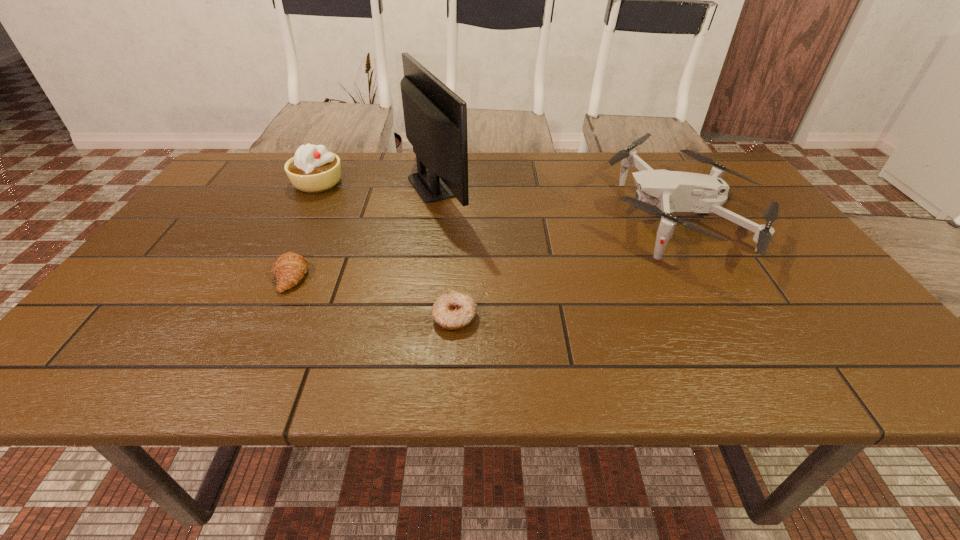
This screenshot has height=540, width=960. What are the coordinates of `vacant point at the left edge` in the screenshot? It's located at (192, 218).

Identify the location of free region at the right edge of the desktop. The image size is (960, 540). (801, 289).

You are a GUI agent. You are given a task and a screenshot of the screen. Output one action in this format:
    pyautogui.click(x=<x>, y=<y>)
    Task: Click on the vacant point at the near left corner
    The image size is (960, 540).
    Given the screenshot: What is the action you would take?
    pyautogui.click(x=132, y=374)

In the image, there is a desktop. In order to click on vacant space at the near right corner in this screenshot , I will do `click(842, 364)`.

Locate an element on the screen. The width and height of the screenshot is (960, 540). free spot between the whipped cream and the drone is located at coordinates (498, 199).

Locate an element on the screen. free spot between the crescent roll and the computer monitor is located at coordinates (364, 231).

Where is `vacant region between the rightmost object and the whipped cream`? This screenshot has height=540, width=960. vacant region between the rightmost object and the whipped cream is located at coordinates (498, 199).

At what (x,y) coordinates should I click in order to perform the action: click on empty space that is in between the doughnut and the whipped cream. Please return your answer as a coordinate pair (x, y). The image size is (960, 540). Looking at the image, I should click on pyautogui.click(x=386, y=249).

Image resolution: width=960 pixels, height=540 pixels. Find the location of `free space between the rightmost object and the whipped cream`. free space between the rightmost object and the whipped cream is located at coordinates (498, 199).

Where is `vacant space that's between the whipped cream and the tallest object`? vacant space that's between the whipped cream and the tallest object is located at coordinates (377, 184).